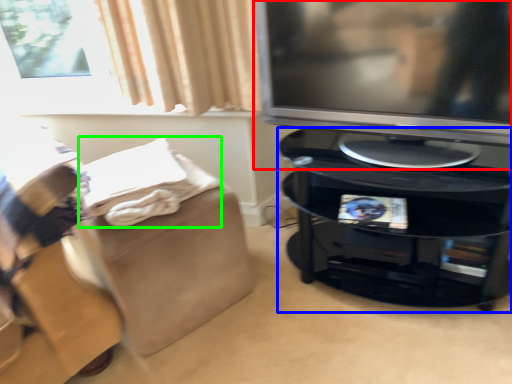
Question: Considering the real-world distances, which object is closest to television (highlighted by a red box)? furniture (highlighted by a blue box) or blanket (highlighted by a green box).

Choices:
 (A) furniture
 (B) blanket

Answer: (A)